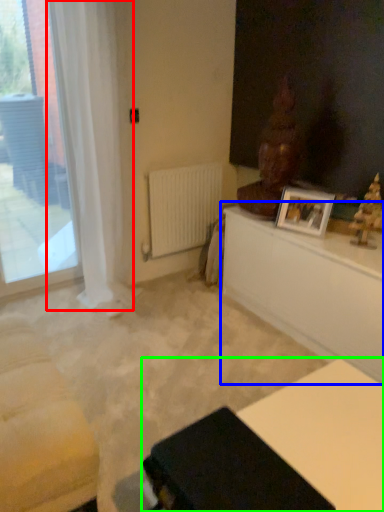
Question: Which object is positioned closest to curtain (highlighted by a red box)? Select from table (highlighted by a blue box) and table (highlighted by a green box).

Choices:
 (A) table
 (B) table

Answer: (A)